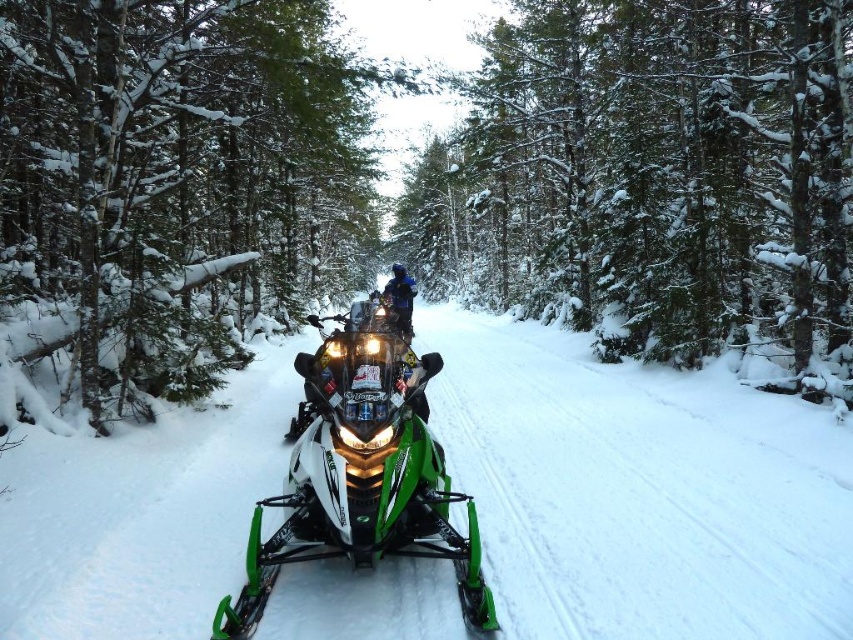
Question: Which point is farther from the camera taking this photo?

Choices:
 (A) (399, 310)
 (B) (10, 173)

Answer: (A)

Question: Which of the following is the farthest from the observer?

Choices:
 (A) (341, 500)
 (B) (142, 429)
 (C) (451, 273)

Answer: (C)

Question: Can you confirm if green textured snowmobile at center is smaller than green matte/snowmobile at center?

Choices:
 (A) yes
 (B) no

Answer: (B)

Question: Is green matte snowmobile at center below blue fabric jacket at center?

Choices:
 (A) yes
 (B) no

Answer: (A)

Question: Is green matte tree at center to the left of green textured snowmobile at center from the viewer's perspective?

Choices:
 (A) no
 (B) yes

Answer: (B)

Question: Which of these objects is positioned farthest from the green textured snowmobile at center?

Choices:
 (A) green matte snowmobile at center
 (B) blue fabric jacket at center
 (C) green matte/snowmobile at center

Answer: (B)